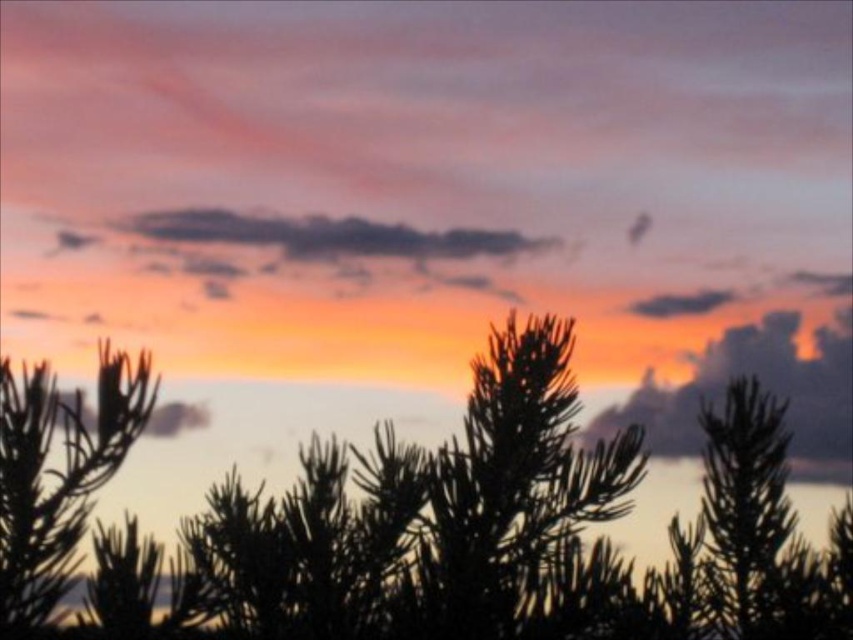
Which is more to the right, silvery green needles at left or dark gray cloud at upper center?

dark gray cloud at upper center

This screenshot has width=853, height=640. What do you see at coordinates (57, 476) in the screenshot?
I see `silvery green needles at left` at bounding box center [57, 476].

This screenshot has width=853, height=640. In order to click on silvery green needles at left in this screenshot , I will do `click(57, 476)`.

Which is below, silhouette pine tree at center or silvery green needles at left?

silhouette pine tree at center is lower down.

Is point (112, 387) closer to camera compared to point (3, 476)?

No, it is not.

In order to click on silhouette pine tree at center in this screenshot , I will do `click(421, 524)`.

Is point (253, 592) farther from camera compared to point (668, 301)?

No, (253, 592) is in front of (668, 301).

Can you confirm if silhouette pine tree at center is positioned above dark gray cloud at upper center?

Incorrect, silhouette pine tree at center is not positioned above dark gray cloud at upper center.

Locate an element on the screen. Image resolution: width=853 pixels, height=640 pixels. silhouette pine tree at center is located at coordinates (421, 524).